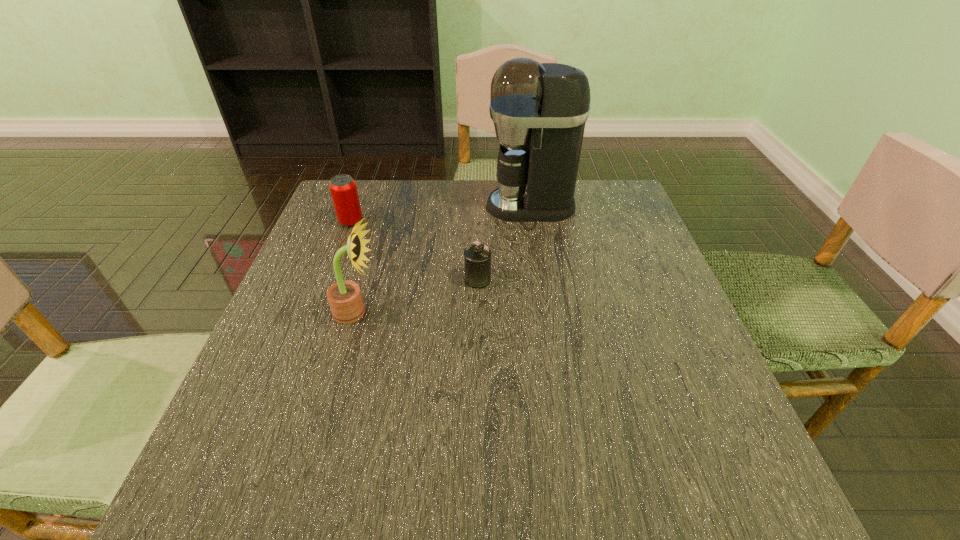
Find the location of `unoccupied area between the nearest object and the right can`. unoccupied area between the nearest object and the right can is located at coordinates (417, 296).

Locate an element on the screen. Image resolution: width=960 pixels, height=540 pixels. free space that is in between the taller can and the coffee maker is located at coordinates (441, 214).

The height and width of the screenshot is (540, 960). What are the coordinates of `unoccupied area between the farther can and the coffee maker` in the screenshot? It's located at (441, 214).

You are a GUI agent. You are given a task and a screenshot of the screen. Output one action in this format:
    pyautogui.click(x=<x>, y=<y>)
    Task: Click on the vacant area that lies between the coffee maker and the third farthest object
    
    Given the screenshot: What is the action you would take?
    pyautogui.click(x=504, y=243)

This screenshot has height=540, width=960. In order to click on free space that is in between the tallest object and the third farthest object in this screenshot , I will do `click(504, 243)`.

Find the location of `object that can be found as the third closest to the farther can`. object that can be found as the third closest to the farther can is located at coordinates (539, 110).

Identify which object is the second nearest to the third farthest object. Please provide its 2D coordinates. Your answer should be formatted as a tuple, i.e. [(x, y)], where the tuple contains the x and y coordinates of a point satisfying the conditions above.

[(539, 110)]